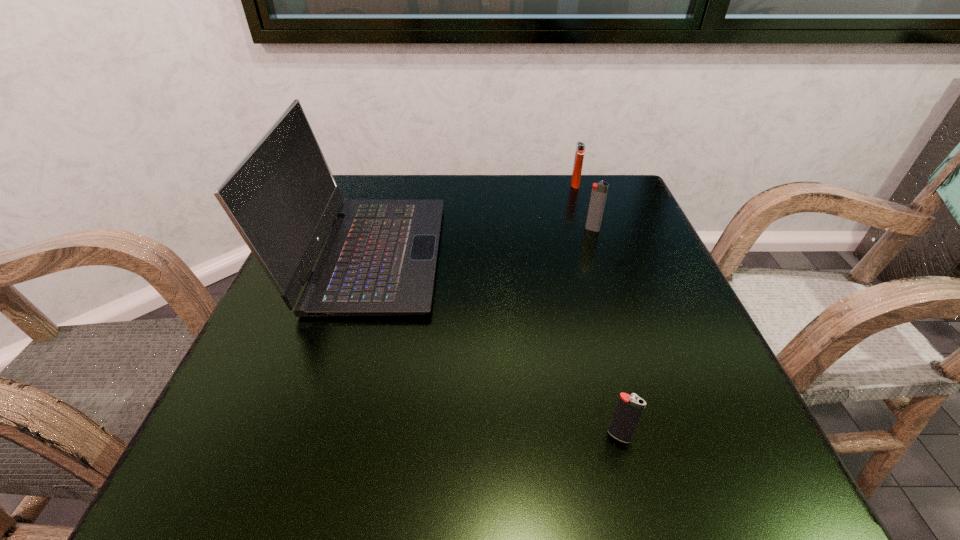
The height and width of the screenshot is (540, 960). Identify the location of free space at the near right corner of the desktop. (756, 472).

Locate an element on the screen. This screenshot has height=540, width=960. vacant space that is in between the tallest object and the nearest object is located at coordinates (494, 345).

The width and height of the screenshot is (960, 540). In order to click on vacant space in between the shortest igniter and the farthest igniter in this screenshot , I will do `click(597, 310)`.

This screenshot has width=960, height=540. What are the coordinates of `free space between the second farthest igniter and the leftmost object` in the screenshot? It's located at (481, 241).

You are a GUI agent. You are given a task and a screenshot of the screen. Output one action in this format:
    pyautogui.click(x=<x>, y=<y>)
    Task: Click on the free point between the nearest object and the second farthest igniter
    
    Given the screenshot: What is the action you would take?
    pyautogui.click(x=606, y=333)

Find the location of a particular element. Image resolution: width=960 pixels, height=540 pixels. vacant area that lies between the leftmost igniter and the farthest igniter is located at coordinates (597, 310).

You are a GUI agent. You are given a task and a screenshot of the screen. Output one action in this format:
    pyautogui.click(x=<x>, y=<y>)
    Task: Click on the vacant point located between the laptop computer and the farthest object
    The image size is (960, 540).
    Given the screenshot: What is the action you would take?
    pyautogui.click(x=472, y=219)

This screenshot has width=960, height=540. I want to click on free area in between the shortest igniter and the laptop computer, so click(494, 345).

Where is `vacant space that's between the farthest object and the tallest object`? The height and width of the screenshot is (540, 960). vacant space that's between the farthest object and the tallest object is located at coordinates (472, 219).

Where is `vacant point located between the laptop computer and the leftmost igniter`? vacant point located between the laptop computer and the leftmost igniter is located at coordinates (494, 345).